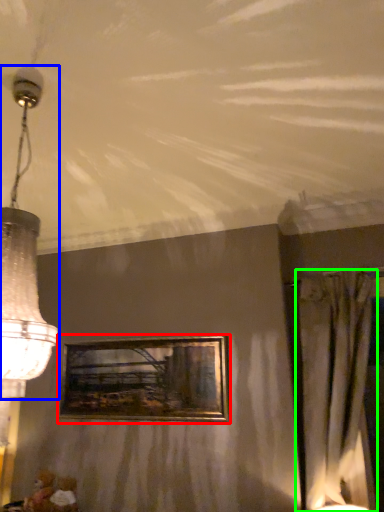
Question: Estimate the real-world distances between objects in this image. Which object is farther from picture frame (highlighted by a red box), lamp (highlighted by a blue box) or curtain (highlighted by a green box)?

Choices:
 (A) lamp
 (B) curtain

Answer: (A)